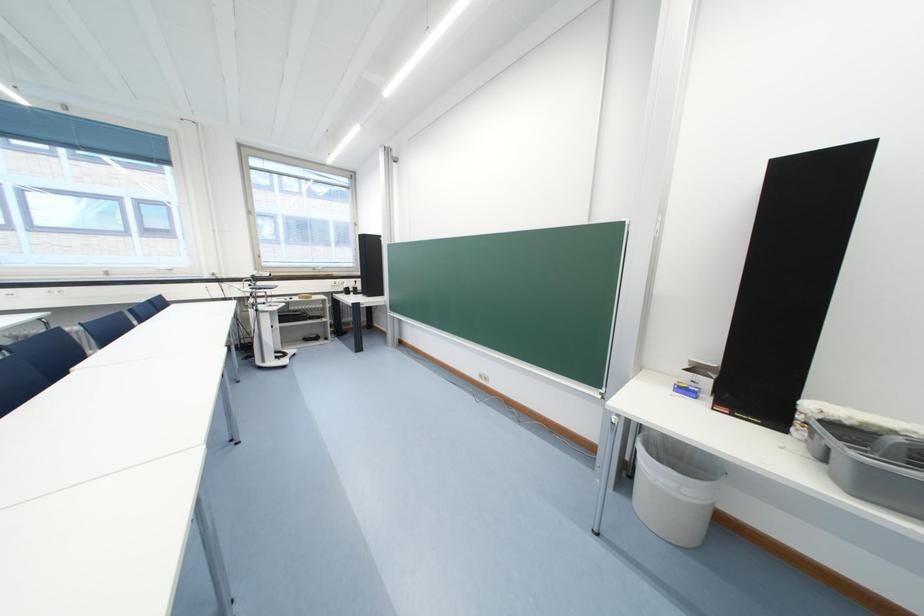
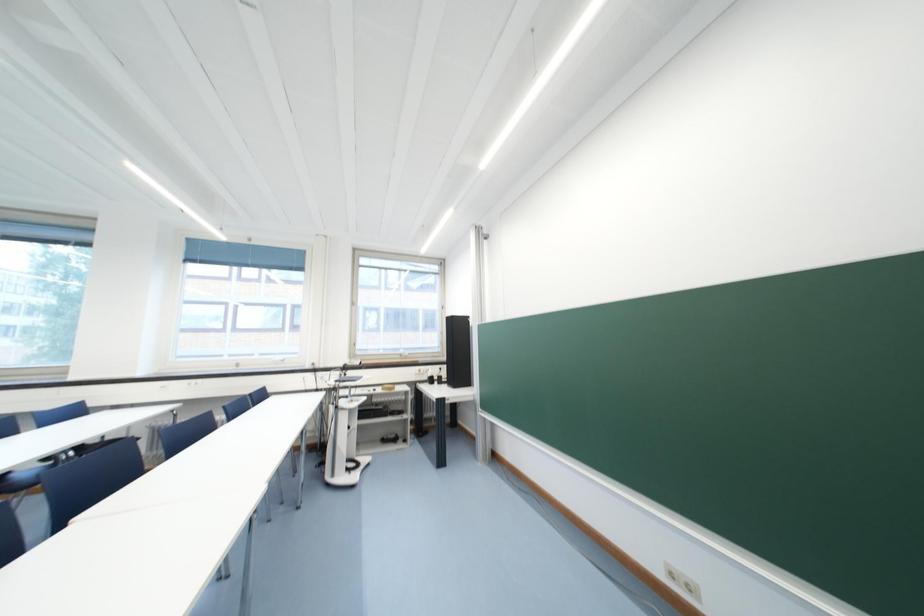
The first image is from the beginning of the video and the second image is from the end. How did the camera likely rotate when shooting the video?

The camera rotated toward left-up.